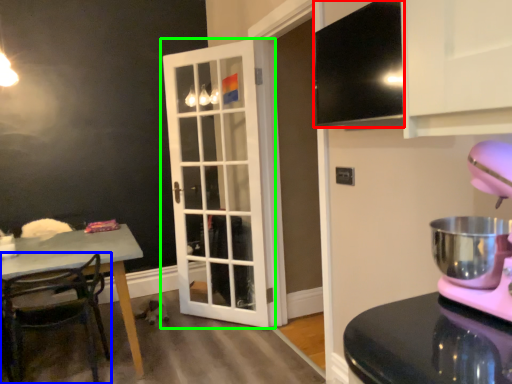
Question: Based on their relative distances, which object is nearer to exhaust hood (highlighted by a red box)? Choose from chair (highlighted by a blue box) and door (highlighted by a green box).

Choices:
 (A) chair
 (B) door

Answer: (B)